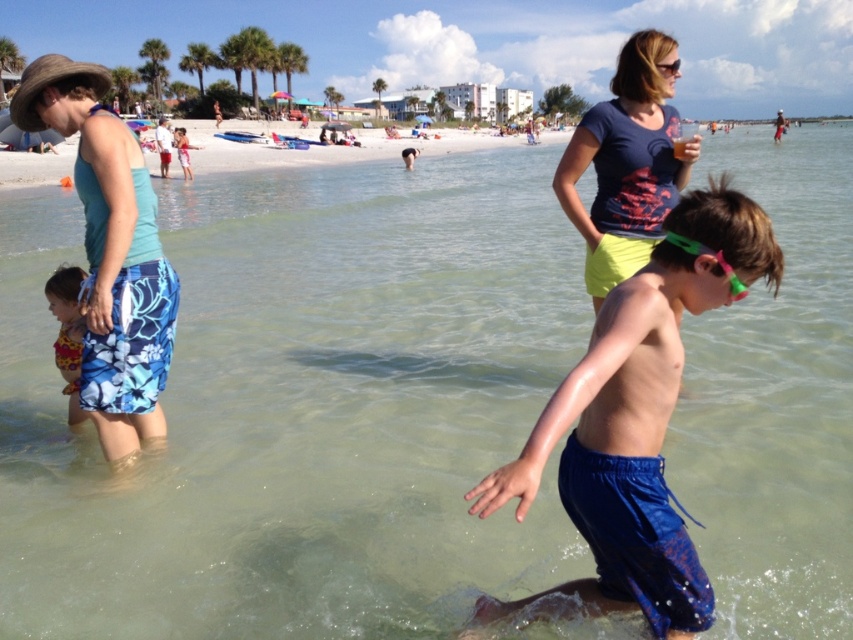
Based on the photo, which of these two, white sand beach at center or printed fabric swimsuit at lower left, stands shorter?

printed fabric swimsuit at lower left

Is point (70, 161) positioned behind point (73, 323)?

Yes.

Locate an element on the screen. The height and width of the screenshot is (640, 853). white sand beach at center is located at coordinates (332, 148).

Which of these two, teal fabric tank top at left or matte blue t-shirt at upper center, stands taller?

Standing taller between the two is matte blue t-shirt at upper center.

Between point (119, 147) and point (637, 61), which one is positioned behind?

The point (637, 61) is more distant.

Is point (84, 400) closer to camera compared to point (601, 170)?

Yes, point (84, 400) is in front of point (601, 170).

The image size is (853, 640). Find the location of `teal fabric tank top at left`. teal fabric tank top at left is located at coordinates coord(109,252).

In the scene shown: Does teal fabric tank top at left have a greater width compared to printed fabric swimsuit at lower left?

Indeed, teal fabric tank top at left has a greater width compared to printed fabric swimsuit at lower left.

Who is more distant from viewer, (132,256) or (64,298)?

The point (64,298) is behind.

Where is `teal fabric tank top at left`? teal fabric tank top at left is located at coordinates (109, 252).

You are a GUI agent. You are given a task and a screenshot of the screen. Output one action in this format:
    pyautogui.click(x=<x>, y=<y>)
    Task: Click on the teal fabric tank top at left
    This screenshot has width=853, height=640.
    Given the screenshot: What is the action you would take?
    pyautogui.click(x=109, y=252)